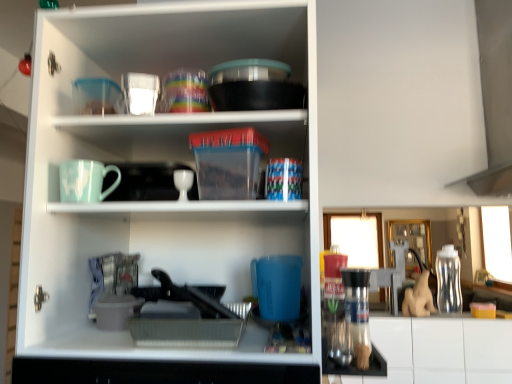
Question: Are matte ceramic mug at upper left and transparent plastic bottle at right beside each other?

Choices:
 (A) no
 (B) yes

Answer: (A)

Question: Does matte ceramic mug at upper left have a lesser width compared to transparent plastic bottle at right?

Choices:
 (A) no
 (B) yes

Answer: (B)

Question: Can you confirm if matte ceramic mug at upper left is taller than transparent plastic bottle at right?

Choices:
 (A) yes
 (B) no

Answer: (B)

Question: Is there a large distance between matte ceramic mug at upper left and transparent plastic bottle at right?

Choices:
 (A) yes
 (B) no

Answer: (A)

Question: From the image's perspective, would you say matte ceramic mug at upper left is shown under transparent plastic bottle at right?

Choices:
 (A) yes
 (B) no

Answer: (B)

Question: Considering the positions of matte ceramic mug at upper left and transparent glass cup at upper center, placed as the 2th tableware when sorted from bottom to top, in the image, is matte ceramic mug at upper left wider or thinner than transparent glass cup at upper center, placed as the 2th tableware when sorted from bottom to top,?

Choices:
 (A) thin
 (B) wide

Answer: (B)

Question: Considering the positions of matte ceramic mug at upper left and transparent glass cup at upper center, placed as the 2th tableware when sorted from bottom to top, in the image, is matte ceramic mug at upper left taller or shorter than transparent glass cup at upper center, placed as the 2th tableware when sorted from bottom to top,?

Choices:
 (A) short
 (B) tall

Answer: (B)

Question: Looking at the image, does matte ceramic mug at upper left seem bigger or smaller compared to transparent glass cup at upper center, acting as the 2th tableware starting from the top?

Choices:
 (A) small
 (B) big

Answer: (B)

Question: Do you think matte ceramic mug at upper left is within transparent glass cup at upper center, placed as the 2th tableware when sorted from bottom to top, or outside of it?

Choices:
 (A) inside
 (B) outside

Answer: (B)

Question: Would you say transparent plastic bottle at right is to the left or to the right of translucent plastic cups at upper center, which appears as the 1th tableware when viewed from the top, in the picture?

Choices:
 (A) right
 (B) left

Answer: (A)

Question: From a real-world perspective, is transparent plastic bottle at right positioned above or below translucent plastic cups at upper center, the 3th tableware ordered from the bottom?

Choices:
 (A) above
 (B) below

Answer: (B)

Question: Does point (455, 259) appear closer or farther from the camera than point (188, 72)?

Choices:
 (A) closer
 (B) farther

Answer: (B)

Question: From the image's perspective, relative to translucent plastic cups at upper center, which appears as the 1th tableware when viewed from the top, is transparent plastic bottle at right above or below?

Choices:
 (A) below
 (B) above

Answer: (A)

Question: Relative to translucent plastic cups at upper center, the 3th tableware ordered from the bottom, is matte ceramic mug at upper left in front or behind?

Choices:
 (A) front
 (B) behind

Answer: (A)

Question: From the image's perspective, is matte ceramic mug at upper left positioned above or below translucent plastic cups at upper center, which appears as the 1th tableware when viewed from the top?

Choices:
 (A) above
 (B) below

Answer: (B)